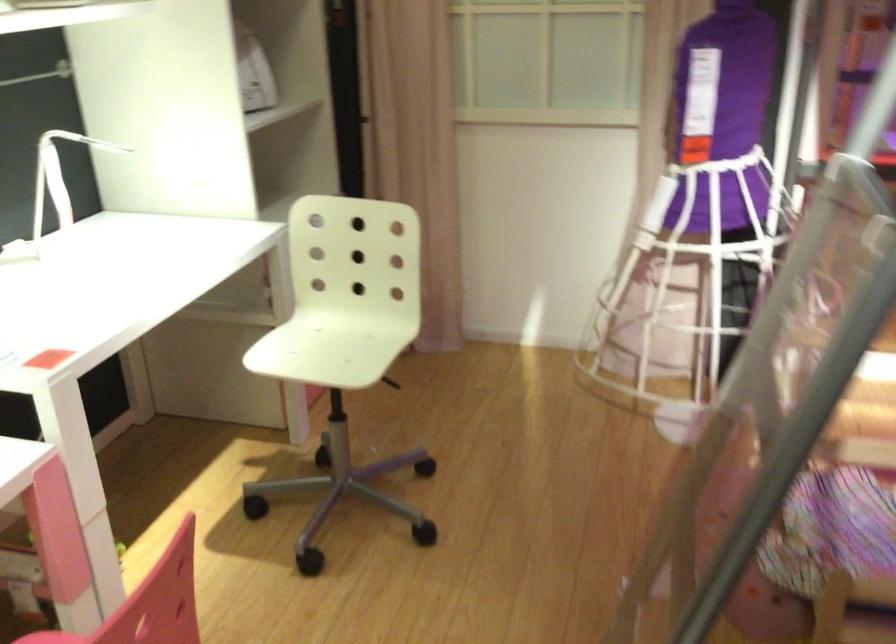
This screenshot has height=644, width=896. What are the coordinates of `white chair sitting surface` in the screenshot? It's located at (331, 345).